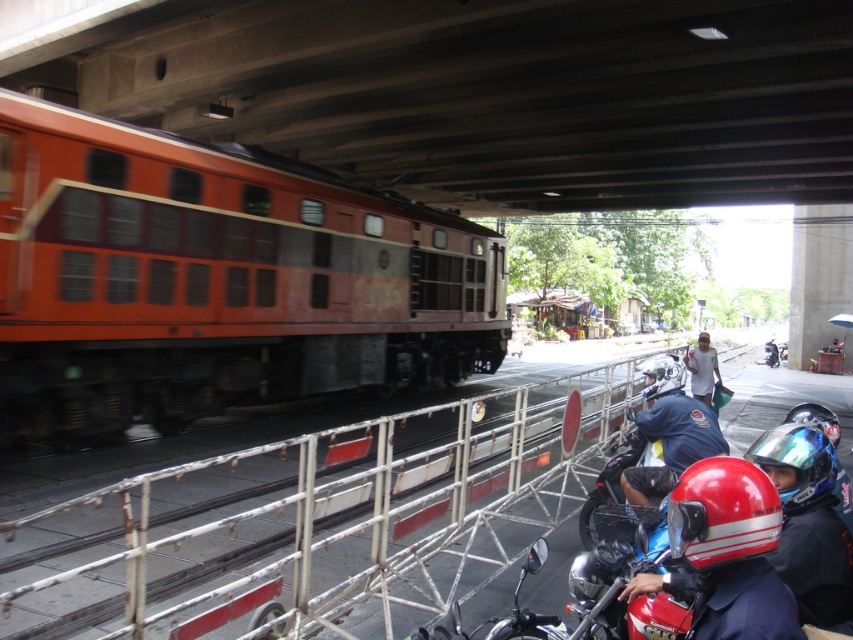
You are standing at the railway crossing and see the shiny red helmet at lower right. Where exactly is it located in terms of coordinates?

The shiny red helmet at lower right is located at coordinates point (724, 554).

You are a pedestrian standing at the railway crossing and see the orange matte train at left and the shiny blue helmet at center. Which object is closer to the left side of the railway tracks?

The orange matte train at left is closer to the left side of the railway tracks because it is positioned to the left of the shiny blue helmet at center.

Based on the photo, you are a pedestrian standing at the railway crossing and see the shiny red helmet at lower right and the white matte shirt at right. Which object is positioned higher from the ground?

The shiny red helmet at lower right is located above the white matte shirt at right, so it is positioned higher from the ground.